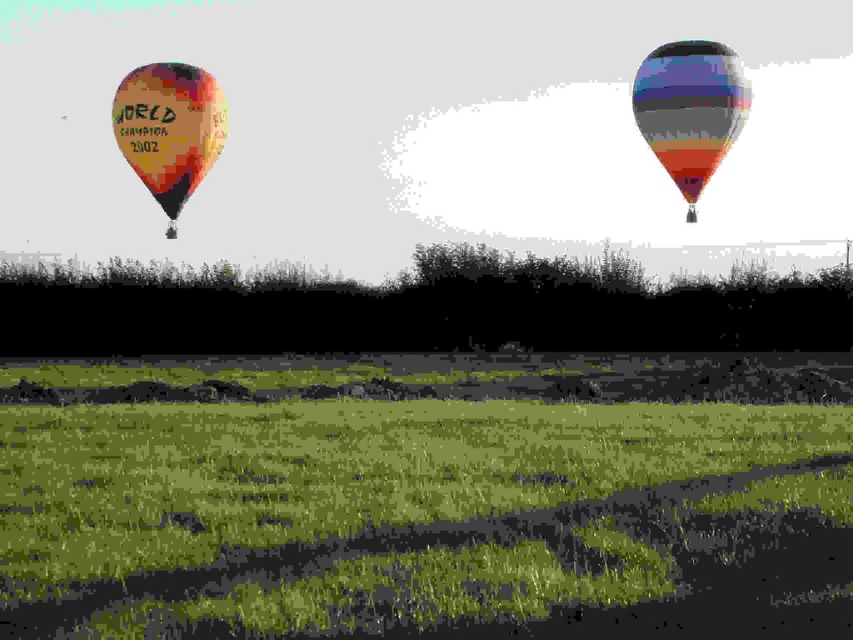
Can you confirm if multicolored striped balloon at upper right is positioned to the left of multicolored fabric balloon at left?

No, multicolored striped balloon at upper right is not to the left of multicolored fabric balloon at left.

Is point (680, 157) positioned after point (167, 172)?

Yes, it is.

Where is `multicolored striped balloon at upper right`? The height and width of the screenshot is (640, 853). multicolored striped balloon at upper right is located at coordinates (689, 109).

Which is in front, point (589, 465) or point (682, 54)?

Positioned in front is point (589, 465).

Is green grassy field at lower center to the right of multicolored striped balloon at upper right from the viewer's perspective?

Incorrect, green grassy field at lower center is not on the right side of multicolored striped balloon at upper right.

Locate an element on the screen. The image size is (853, 640). green grassy field at lower center is located at coordinates (410, 492).

Identify the location of green grassy field at lower center. (410, 492).

Where is `green grassy field at lower center`? green grassy field at lower center is located at coordinates (410, 492).

Does green grassy field at lower center appear on the right side of multicolored fabric balloon at left?

Indeed, green grassy field at lower center is positioned on the right side of multicolored fabric balloon at left.

Locate an element on the screen. green grassy field at lower center is located at coordinates (410, 492).